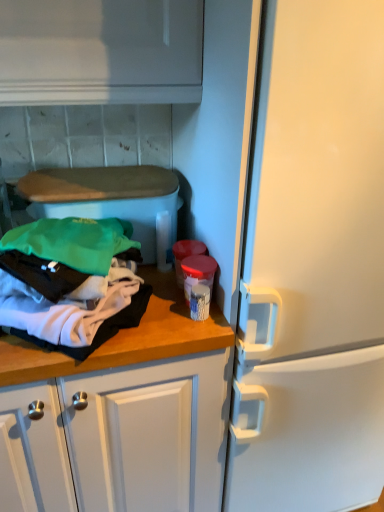
Question: Is point (49, 298) positioned closer to the camera than point (142, 325)?

Choices:
 (A) closer
 (B) farther

Answer: (A)

Question: Based on their sizes in the image, would you say soft cotton clothes at left is bigger or smaller than wooden at left?

Choices:
 (A) big
 (B) small

Answer: (A)

Question: Is soft cotton clothes at left situated inside wooden at left or outside?

Choices:
 (A) inside
 (B) outside

Answer: (B)

Question: In the image, is wooden at left on the left side or the right side of soft cotton clothes at left?

Choices:
 (A) left
 (B) right

Answer: (B)

Question: Is wooden at left bigger or smaller than soft cotton clothes at left?

Choices:
 (A) small
 (B) big

Answer: (A)

Question: From their relative heights in the image, would you say wooden at left is taller or shorter than soft cotton clothes at left?

Choices:
 (A) tall
 (B) short

Answer: (B)

Question: Is point (196, 345) positioned closer to the camera than point (18, 245)?

Choices:
 (A) closer
 (B) farther

Answer: (B)